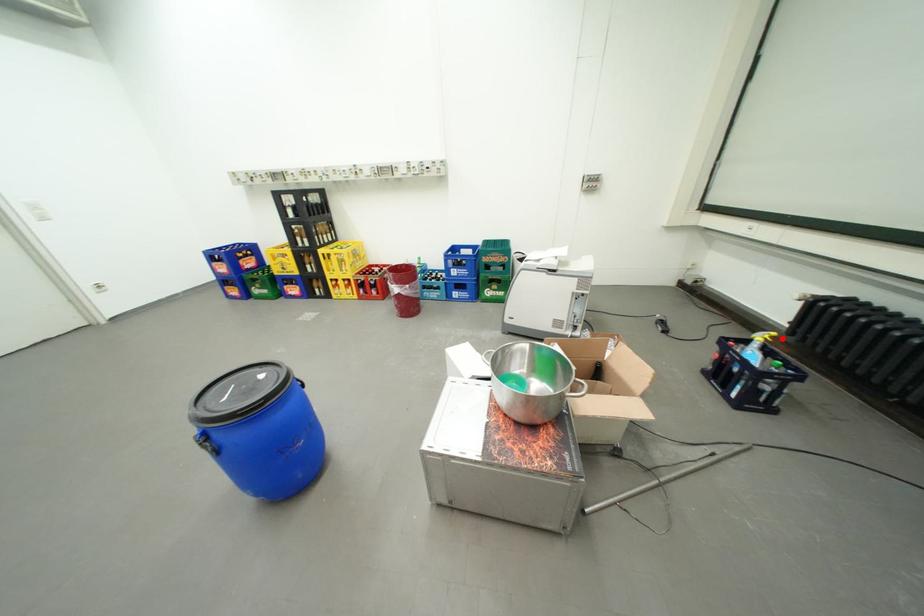
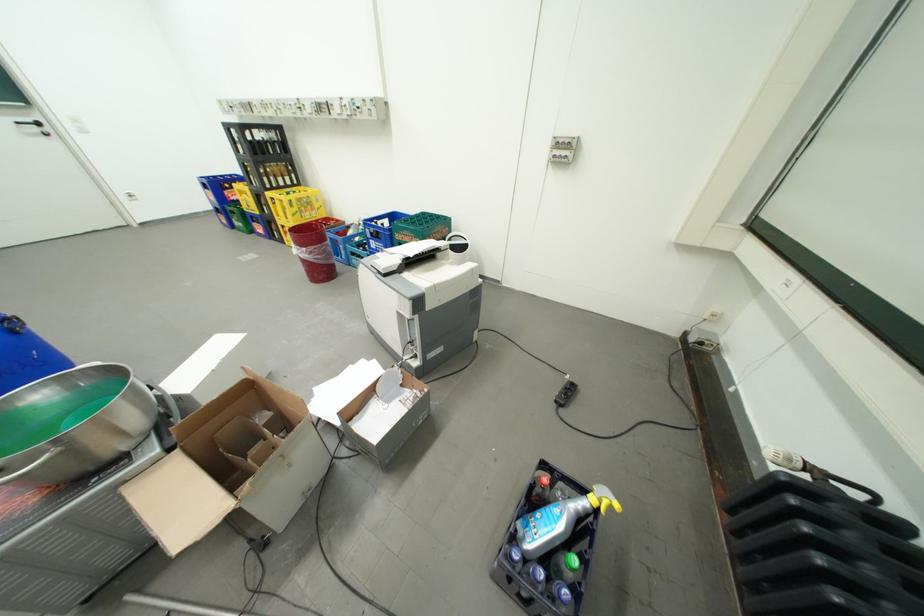
Question: I am providing you with two images of the same scene from different viewpoints. A red point is shown in image1. For the corresponding object point in image2, is it positioned nearer or farther from the camera?

Choices:
 (A) Nearer
 (B) Farther

Answer: (B)